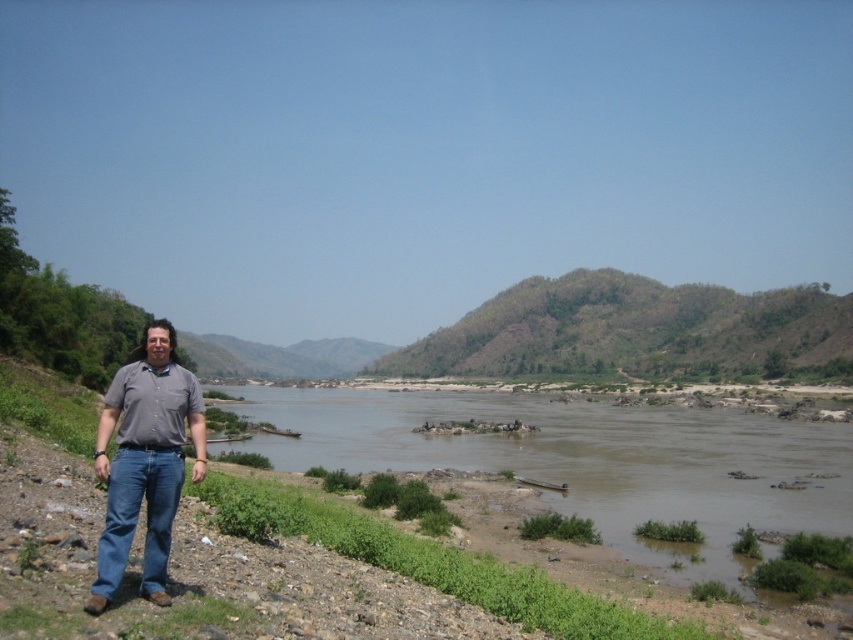
Question: Is brown muddy water at center below denim jeans at left?

Choices:
 (A) yes
 (B) no

Answer: (A)

Question: Does brown muddy water at center lie in front of denim jeans at left?

Choices:
 (A) no
 (B) yes

Answer: (A)

Question: Is brown muddy water at center bigger than denim jeans at left?

Choices:
 (A) yes
 (B) no

Answer: (A)

Question: Which object is closer to the camera taking this photo?

Choices:
 (A) brown muddy water at center
 (B) denim jeans at left

Answer: (B)

Question: Which point is farther to the camera?

Choices:
 (A) (138, 369)
 (B) (340, 451)

Answer: (B)